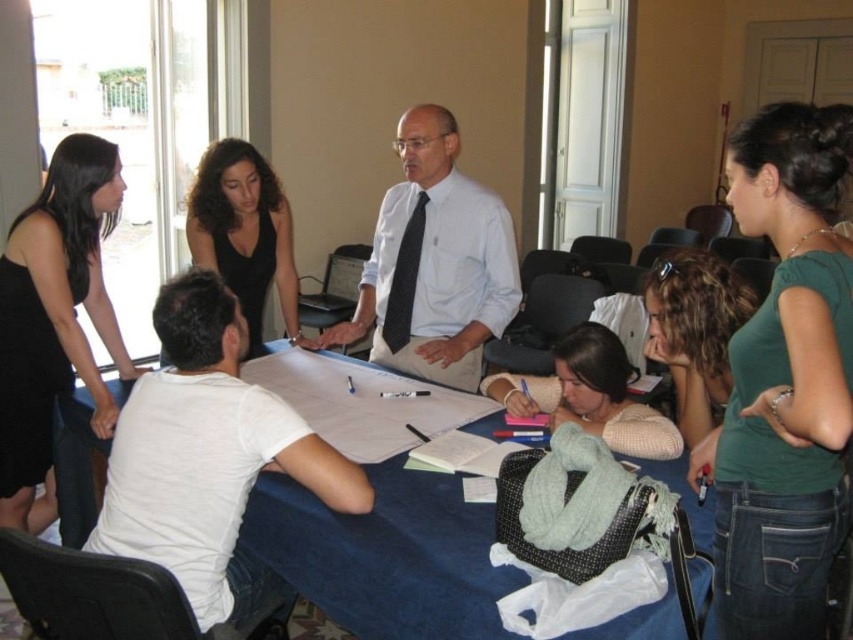
Question: Which is nearer to the knitted sweater at lower center?

Choices:
 (A) black dress at center
 (B) white shirt at center

Answer: (B)

Question: Which point appears closest to the camera in this image?

Choices:
 (A) (28, 262)
 (B) (431, 216)
 (C) (189, 538)

Answer: (C)

Question: Does blue fabric table at center have a smaller size compared to white shirt at center?

Choices:
 (A) yes
 (B) no

Answer: (A)

Question: Which object is closer to the camera taking this photo?

Choices:
 (A) blue fabric table at center
 (B) knitted sweater at lower center
 (C) black dress at center
 (D) white cotton t-shirt at center

Answer: (A)

Question: Is white cotton t-shirt at center above black dress at center?

Choices:
 (A) no
 (B) yes

Answer: (A)

Question: Can you confirm if green matte shirt at upper right is positioned to the right of knitted sweater at lower center?

Choices:
 (A) no
 (B) yes

Answer: (B)